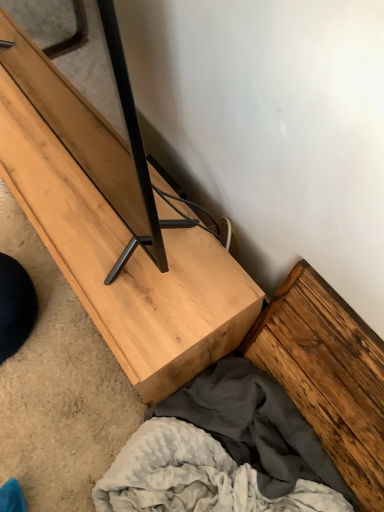
Question: From the image's perspective, is natural wood tv stand at center over black matte wood plank at center, arranged as the first plank when viewed from the left?

Choices:
 (A) yes
 (B) no

Answer: (B)

Question: From the image's perspective, is natural wood tv stand at center under black matte wood plank at center, the 1th plank positioned from the top?

Choices:
 (A) yes
 (B) no

Answer: (A)

Question: From a real-world perspective, is natural wood tv stand at center below black matte wood plank at center, the 2th plank positioned from the right?

Choices:
 (A) no
 (B) yes

Answer: (B)

Question: Is natural wood tv stand at center to the left of black matte wood plank at center, arranged as the first plank when viewed from the left, from the viewer's perspective?

Choices:
 (A) yes
 (B) no

Answer: (B)

Question: Is natural wood tv stand at center smaller than black matte wood plank at center, the 1th plank positioned from the top?

Choices:
 (A) no
 (B) yes

Answer: (B)

Question: Is natural wood tv stand at center wider than black matte wood plank at center, the 1th plank positioned from the top?

Choices:
 (A) yes
 (B) no

Answer: (A)

Question: Considering the relative positions of wooden plank at lower right, acting as the 2th plank starting from the top, and natural wood tv stand at center in the image provided, is wooden plank at lower right, acting as the 2th plank starting from the top, to the left of natural wood tv stand at center from the viewer's perspective?

Choices:
 (A) no
 (B) yes

Answer: (A)

Question: Can you confirm if wooden plank at lower right, acting as the 2th plank starting from the top, is thinner than natural wood tv stand at center?

Choices:
 (A) yes
 (B) no

Answer: (A)

Question: Is wooden plank at lower right, arranged as the 1th plank when ordered from the bottom, closer to the viewer compared to natural wood tv stand at center?

Choices:
 (A) no
 (B) yes

Answer: (B)

Question: Is wooden plank at lower right, acting as the 2th plank starting from the top, smaller than natural wood tv stand at center?

Choices:
 (A) yes
 (B) no

Answer: (A)

Question: Can you confirm if wooden plank at lower right, acting as the 2th plank starting from the top, is taller than natural wood tv stand at center?

Choices:
 (A) yes
 (B) no

Answer: (A)

Question: Is wooden plank at lower right, acting as the second plank starting from the left, behind natural wood tv stand at center?

Choices:
 (A) no
 (B) yes

Answer: (A)

Question: From a real-world perspective, is wooden plank at lower right, arranged as the first plank when viewed from the right, beneath black matte wood plank at center, the 2th plank positioned from the right?

Choices:
 (A) no
 (B) yes

Answer: (B)